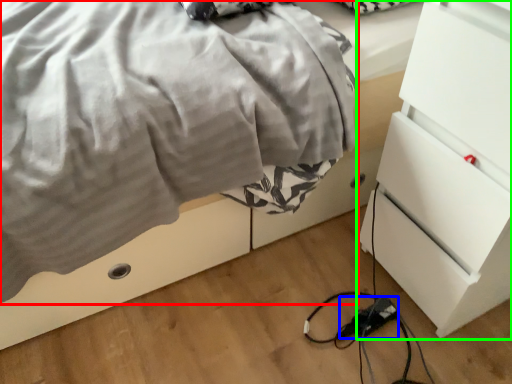
Question: Considering the real-world distances, which object is closest to blanket (highlighted by a red box)? extension cord (highlighted by a blue box) or chest of drawers (highlighted by a green box).

Choices:
 (A) extension cord
 (B) chest of drawers

Answer: (B)